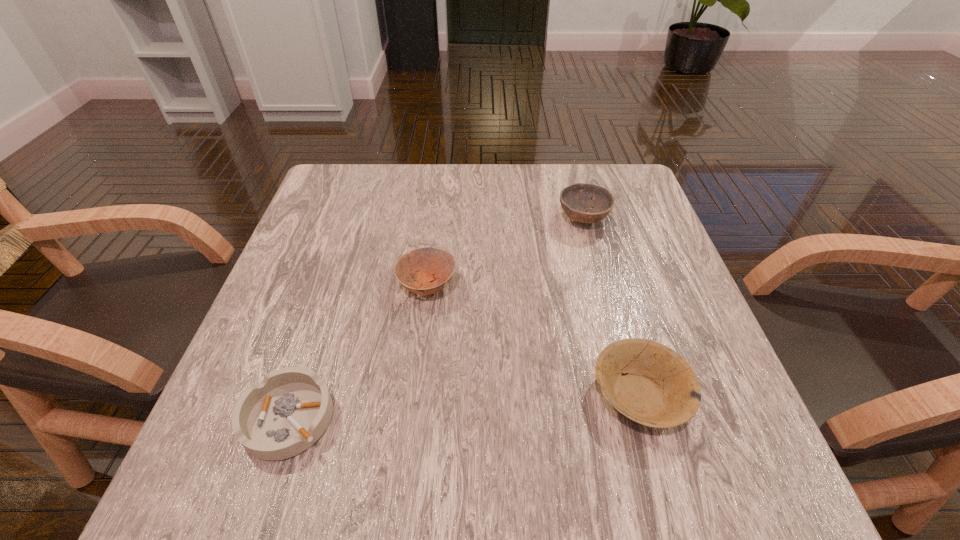
In order to click on the farthest object in this screenshot , I will do `click(576, 199)`.

Image resolution: width=960 pixels, height=540 pixels. I want to click on the second farthest object, so click(435, 266).

The image size is (960, 540). I want to click on the leftmost bowl, so click(435, 266).

You are a GUI agent. You are given a task and a screenshot of the screen. Output one action in this format:
    pyautogui.click(x=<x>, y=<y>)
    Task: Click on the nearest bowl
    The image size is (960, 540).
    Given the screenshot: What is the action you would take?
    pyautogui.click(x=658, y=388)

Locate an element on the screen. the leftmost object is located at coordinates (285, 414).

Where is `the shortest object`? The width and height of the screenshot is (960, 540). the shortest object is located at coordinates (285, 414).

Identify the location of vacant space located 0.380m on the left of the farthest object. The image size is (960, 540). (396, 219).

Identify the location of free region located on the back of the third object from right to left. (435, 221).

Identify the location of free space located 0.190m on the left of the nearest bowl. (474, 395).

What are the coordinates of `vacant space located on the right of the ashtray` in the screenshot? It's located at (588, 417).